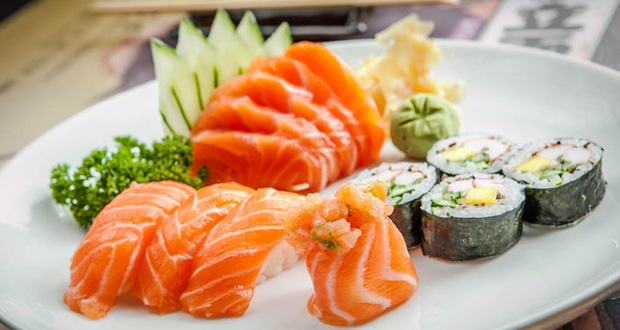
I want to click on table mat, so click(551, 9), click(445, 8), click(546, 26).